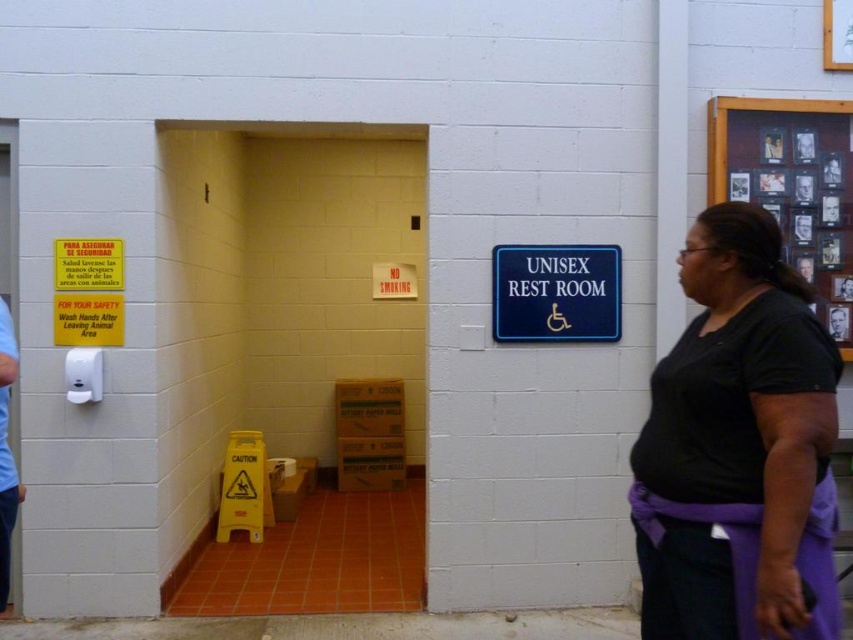
Is black fabric shirt at right to the right of light blue fabric at left from the viewer's perspective?

Yes, black fabric shirt at right is to the right of light blue fabric at left.

Who is more forward, (740, 205) or (0, 538)?

Point (740, 205) is more forward.

Image resolution: width=853 pixels, height=640 pixels. Find the location of `black fabric shirt at right`. black fabric shirt at right is located at coordinates (740, 449).

Does wooden frame at upper right have a greater height compared to blue plastic sign at upper right?

Yes, wooden frame at upper right is taller than blue plastic sign at upper right.

Which of these two, wooden frame at upper right or blue plastic sign at upper right, stands shorter?

With less height is blue plastic sign at upper right.

What do you see at coordinates (791, 179) in the screenshot?
I see `wooden frame at upper right` at bounding box center [791, 179].

Where is `wooden frame at upper right`? The width and height of the screenshot is (853, 640). wooden frame at upper right is located at coordinates (791, 179).

Does black fabric shirt at right have a greater width compared to blue plastic sign at upper right?

No, black fabric shirt at right is not wider than blue plastic sign at upper right.

Who is more distant from viewer, (x=730, y=221) or (x=589, y=284)?

Point (x=589, y=284)

Identify the location of black fabric shirt at right. (740, 449).